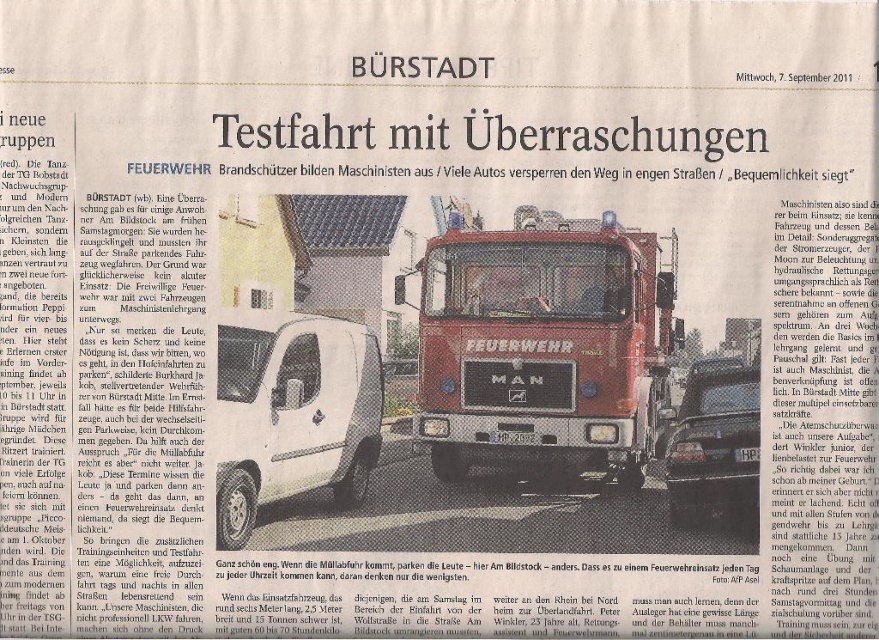
Does point (659, 417) come farther from viewer compared to point (340, 477)?

Yes.

The image size is (879, 640). What do you see at coordinates (543, 344) in the screenshot?
I see `red glossy fire truck at center` at bounding box center [543, 344].

Based on the photo, measure the distance between point (570, 416) and camera.

32.40 feet

I want to click on red glossy fire truck at center, so click(x=543, y=344).

Who is taller, red glossy fire truck at center or shiny black car at center?

red glossy fire truck at center is taller.

Consider the image. Does red glossy fire truck at center have a smaller size compared to shiny black car at center?

Actually, red glossy fire truck at center might be larger than shiny black car at center.

Describe the element at coordinates (543, 344) in the screenshot. I see `red glossy fire truck at center` at that location.

At what (x,y) coordinates should I click in order to perform the action: click on red glossy fire truck at center. Please return your answer as a coordinate pair (x, y). The height and width of the screenshot is (640, 879). Looking at the image, I should click on pos(543,344).

Find the location of `white matte van at center`. white matte van at center is located at coordinates (292, 416).

Is white matte van at center thinner than shiny black car at center?

Incorrect, white matte van at center's width is not less than shiny black car at center's.

Is point (253, 452) positioned before point (750, 458)?

No, (253, 452) is further to viewer.

This screenshot has width=879, height=640. I want to click on white matte van at center, so click(292, 416).